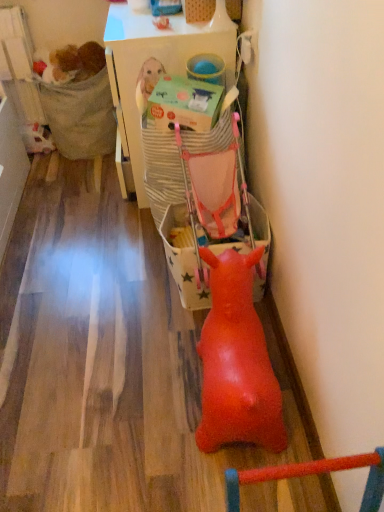
Locate an element on the screen. This screenshot has height=512, width=384. free space in front of white plastic table at upper center is located at coordinates (96, 246).